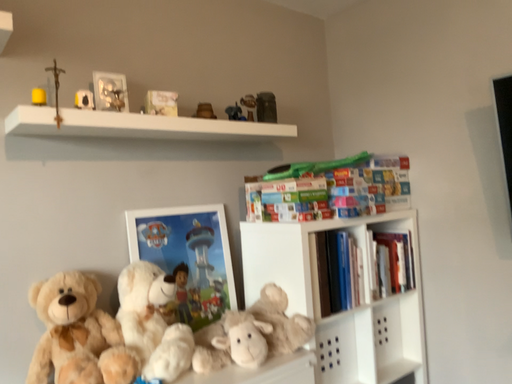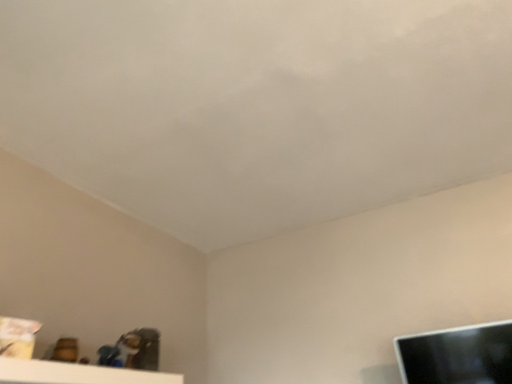
Question: How did the camera likely rotate when shooting the video?

Choices:
 (A) rotated right
 (B) rotated left

Answer: (A)